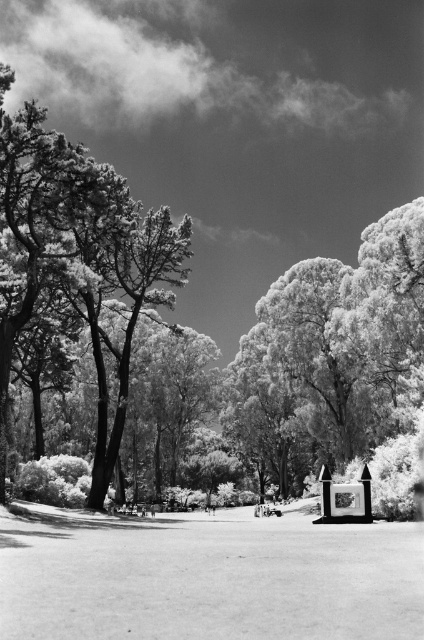
You are a bird looking for a higher perch. You can choose between the smooth bark tree at center and the smooth white tree at left. Which tree should you choose to get a higher vantage point?

The smooth bark tree at center is above the smooth white tree at left, so you should choose the smooth bark tree at center to get a higher vantage point.

You are planning to place a picnic blanket in the park. You want to choose a spot that is closer to the smooth white tree at left and farther from the smooth bark tree at center. Based on the scene description, which tree should you position your blanket near to meet both requirements?

The smooth white tree at left is closer to the picnic blanket spot since it is smaller than the smooth bark tree at center, which is larger and farther away.